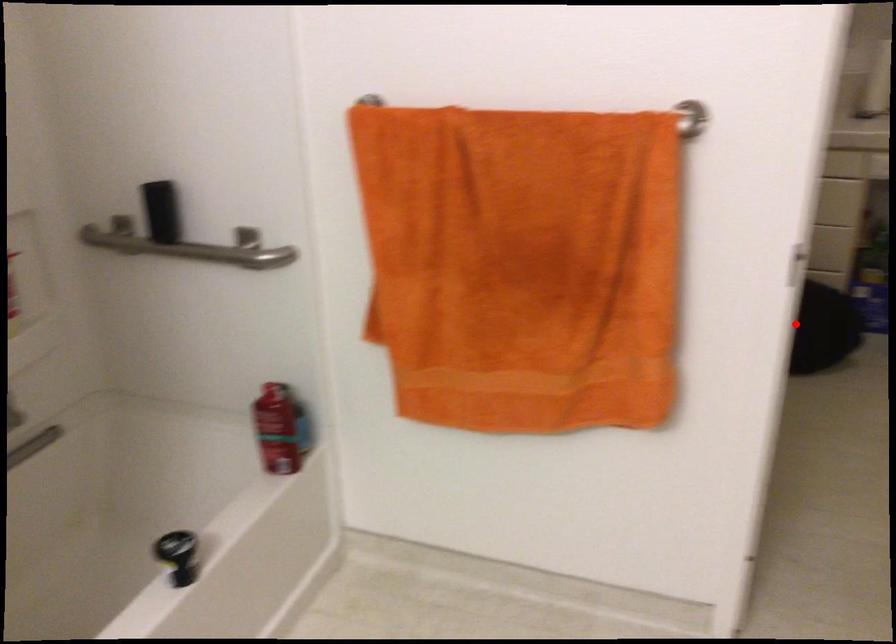
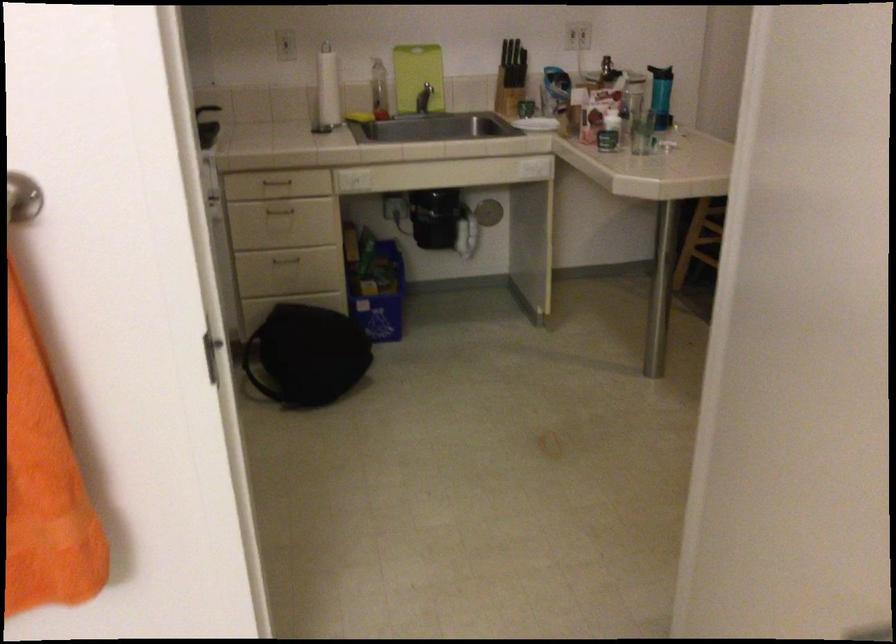
The point at the highlighted location is marked in the first image. Where is the corresponding point in the second image?

(306, 355)